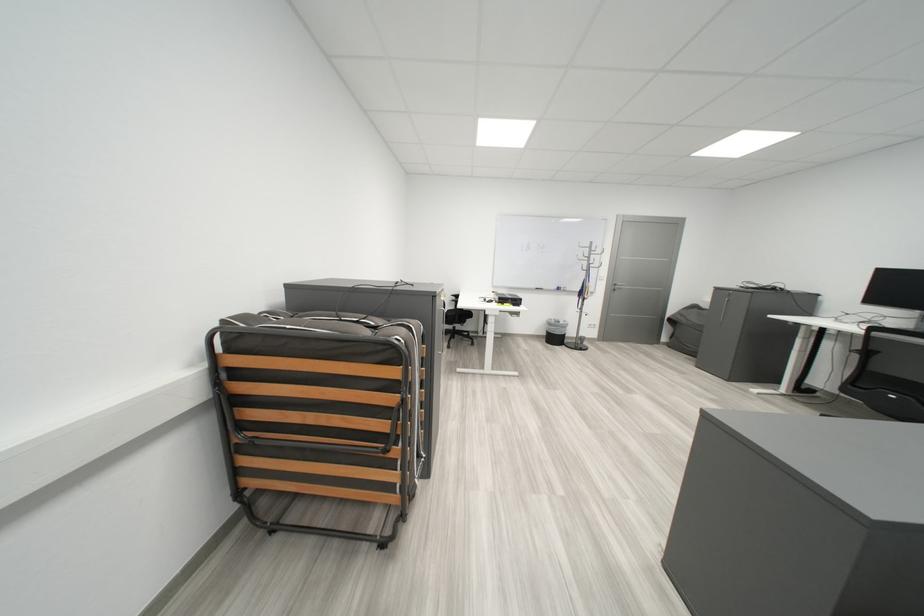
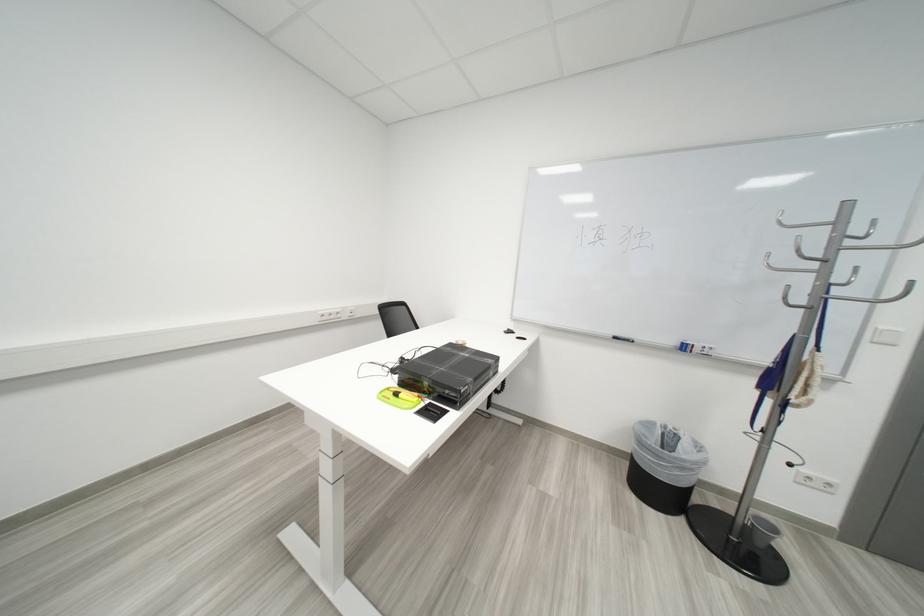
The point at [572,291] is marked in the first image. Where is the corresponding point in the second image?

(698, 350)